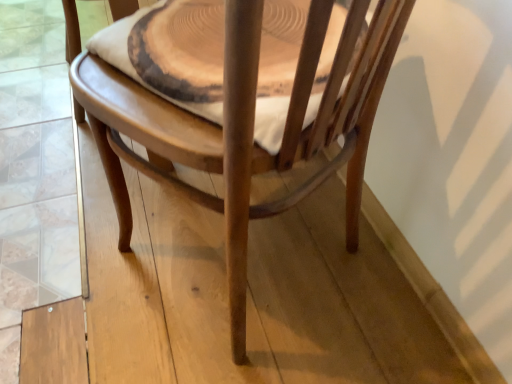
Locate an element on the screen. empty space that is ontop of wooden round table at center (from a real-world perspective) is located at coordinates (221, 33).